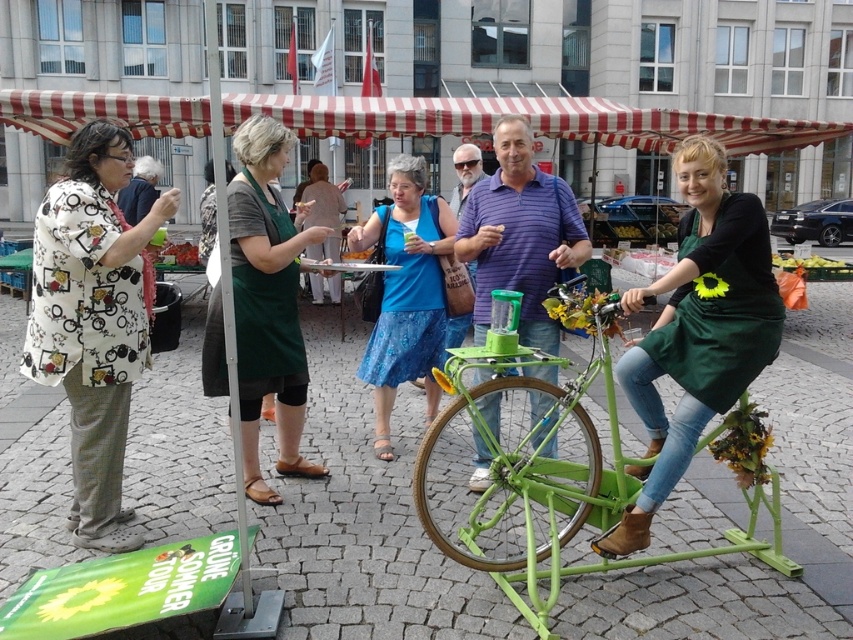
Can you confirm if green apron at center is positioned to the right of blue fabric dress at center?

In fact, green apron at center is to the left of blue fabric dress at center.

Is green apron at center shorter than blue fabric dress at center?

→ No, green apron at center is not shorter than blue fabric dress at center.

Looking at this image, who is more distant from viewer, (x=213, y=301) or (x=392, y=404)?

The point (x=392, y=404) is more distant.

At what (x,y) coordinates should I click in order to perform the action: click on green apron at center. Please return your answer as a coordinate pair (x, y). Looking at the image, I should click on (267, 301).

Is white printed blouse at left above green matte apron at center?

Correct, white printed blouse at left is located above green matte apron at center.

Who is lower down, white printed blouse at left or green matte apron at center?

Positioned lower is green matte apron at center.

Find the location of a particular element. white printed blouse at left is located at coordinates (93, 320).

Between point (502, 288) and point (190, 262), which one is positioned in front?

Point (502, 288)

Is green matte bicycle at center positioned before smooth red tomatoes at center?

Yes, green matte bicycle at center is closer to the viewer.

Image resolution: width=853 pixels, height=640 pixels. In order to click on green matte bicycle at center in this screenshot , I will do `click(520, 234)`.

Locate an element on the screen. This screenshot has height=640, width=853. green matte bicycle at center is located at coordinates (520, 234).